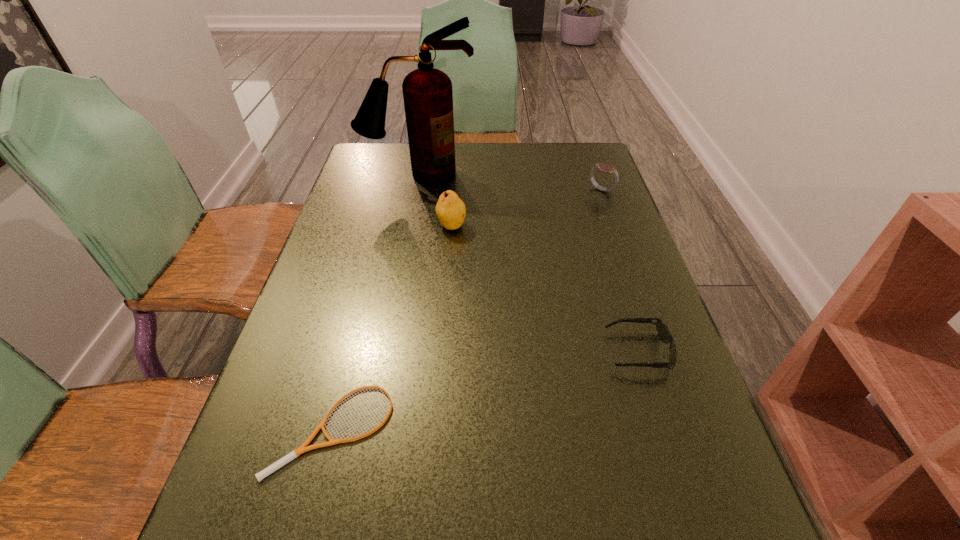
Identify the location of unoccupied position between the fire extinguisher and the fourth shortest object. (435, 200).

Find the location of a particular element. The image size is (960, 540). free space between the tennis racket and the sunglasses is located at coordinates (487, 389).

Identify the location of vacant space in between the shortest object and the tallest object. Image resolution: width=960 pixels, height=540 pixels. (377, 301).

Find the location of a particular element. This screenshot has height=540, width=960. vacant point located between the tennis racket and the third tallest object is located at coordinates (468, 309).

Locate an element on the screen. The height and width of the screenshot is (540, 960). blank region between the tennis racket and the tallest object is located at coordinates (377, 301).

Locate an element on the screen. The width and height of the screenshot is (960, 540). free space between the pear and the sunglasses is located at coordinates (544, 288).

Locate an element on the screen. Image resolution: width=960 pixels, height=540 pixels. object identified as the third closest to the watch is located at coordinates (663, 332).

Where is `the fourth closest object relative to the third farthest object`? the fourth closest object relative to the third farthest object is located at coordinates (292, 455).

The width and height of the screenshot is (960, 540). I want to click on free location that satisfies the following two spatial constraints: 1. at the nozzle of the second tallest object; 2. on the left side of the fire extinguisher, so click(x=408, y=226).

This screenshot has width=960, height=540. I want to click on free space in the image that satisfies the following two spatial constraints: 1. at the nozzle of the fire extinguisher; 2. on the left side of the second tallest object, so click(408, 226).